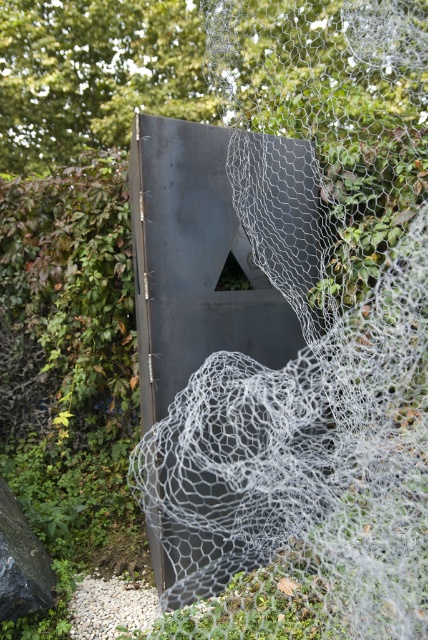
You are a gardener who needs to trim the green leafy hedge at left without damaging the white mesh netting at center. What is the minimum safe distance you should keep between the hedge and the netting during trimming?

The distance between the green leafy hedge at left and the white mesh netting at center is 1.45 meters. To avoid damaging the netting, you should keep at least 1.45 meters between the hedge and the netting during trimming.

You are a gardener planning to trim the green leafy hedge at left so it matches the height of the white mesh netting at center. Based on the scene, which object is currently taller?

The white mesh netting at center is much taller than the green leafy hedge at left, so you should trim the hedge to match the height of the white mesh netting at center.

You are an artist planning to paint this scene. You need to decide which object to focus on first based on their sizes. Which object should you paint first, the white mesh netting at center or the green leafy hedge at left?

The white mesh netting at center is larger in size than the green leafy hedge at left, so you should paint the white mesh netting at center first to ensure proper scaling when adding smaller details later.